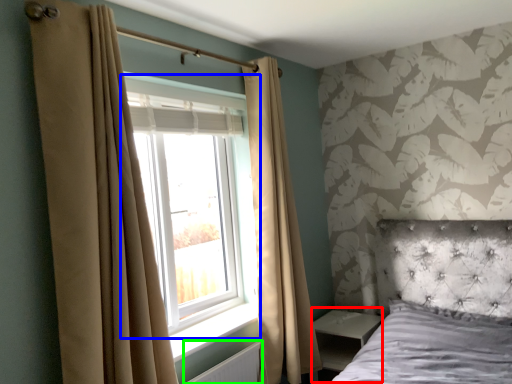
Question: Considering the real-world distances, which object is farthest from side table (highlighted by a red box)? window (highlighted by a blue box) or radiator (highlighted by a green box)?

Choices:
 (A) window
 (B) radiator

Answer: (A)